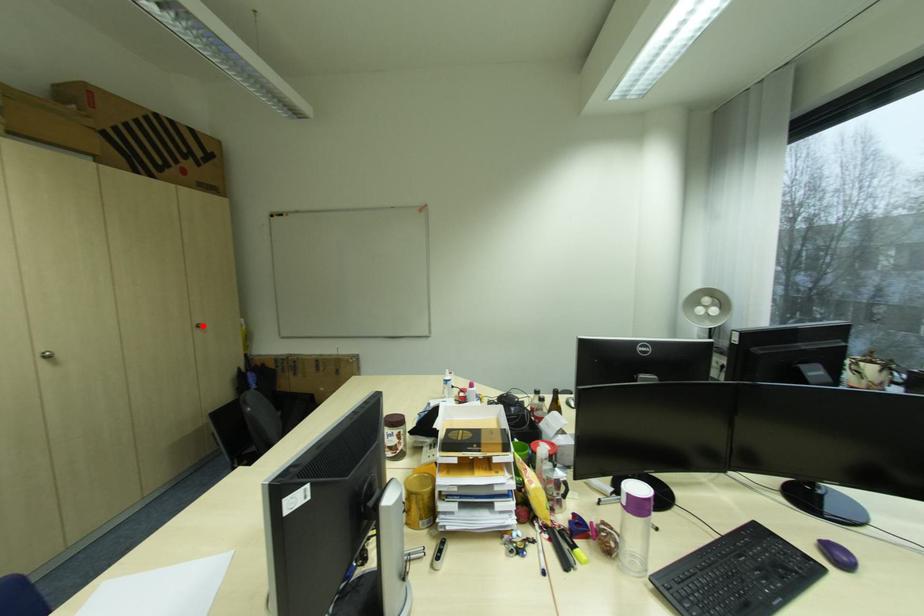
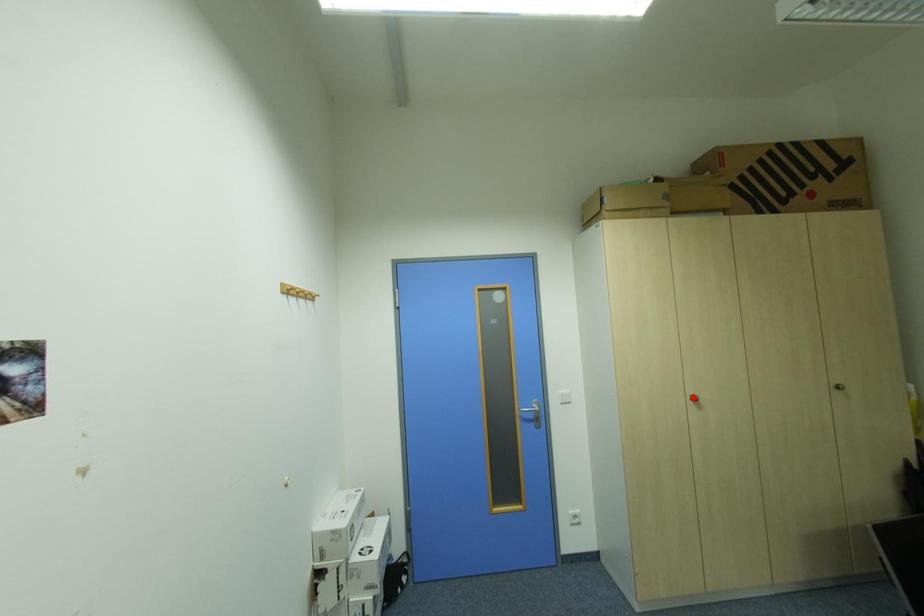
From the picture: I am providing you with two images of the same scene from different viewpoints. A red point is marked on the first image and another point is marked on the second image. Is the red point in image1 aligned with the point shown in image2?

No